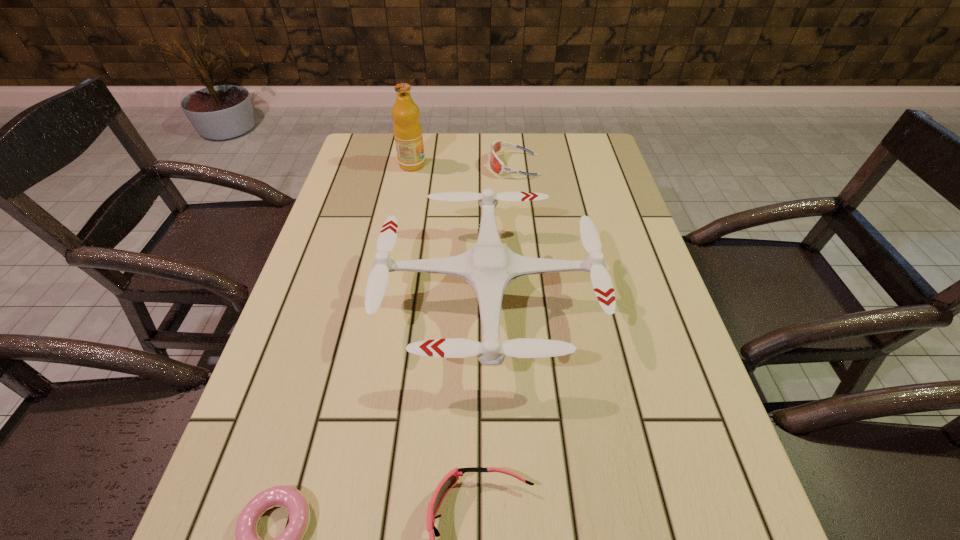
Identify the location of the tallest object. (407, 128).

Find the location of a particular element. the fourth shortest object is located at coordinates (489, 267).

Locate an element on the screen. This screenshot has width=960, height=540. drone is located at coordinates (489, 267).

Find the location of a particular element. This screenshot has height=540, width=960. the taller goggles is located at coordinates (495, 163).

Identify the location of the third tallest object. The width and height of the screenshot is (960, 540). (495, 163).

Where is `blank area located on the front label of the fruit juice`? blank area located on the front label of the fruit juice is located at coordinates (498, 165).

The width and height of the screenshot is (960, 540). What are the coordinates of `free spot located with the camera attached at the bottom of the third farthest object` in the screenshot? It's located at (341, 295).

I want to click on free space located with the camera attached at the bottom of the third farthest object, so click(345, 295).

The height and width of the screenshot is (540, 960). What are the coordinates of `free space located with the camera attached at the bottom of the third farthest object` in the screenshot? It's located at (301, 295).

You are a GUI agent. You are given a task and a screenshot of the screen. Output one action in this format:
    pyautogui.click(x=<x>, y=<y>)
    Task: Click on the free region located 0.200m on the front-facing side of the third shortest object
    
    Given the screenshot: What is the action you would take?
    pyautogui.click(x=424, y=165)